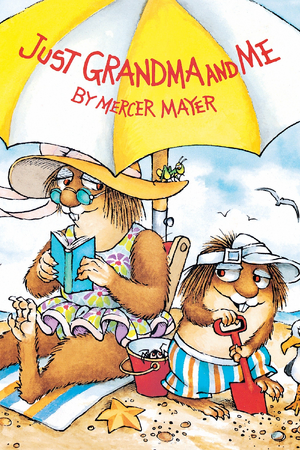
Identify the location of book. Image resolution: width=300 pixels, height=450 pixels. (65, 260).